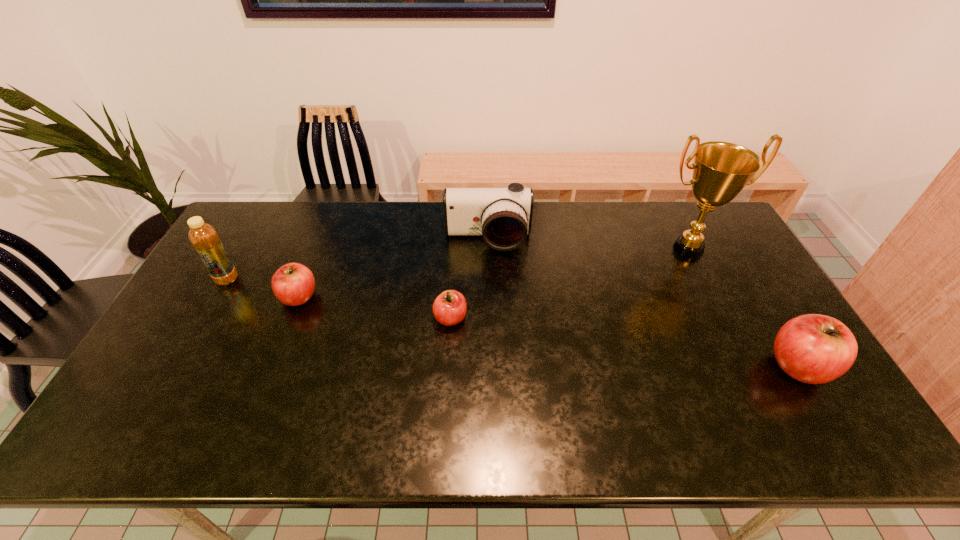
Please mark a free spot for a new apple to balance the arrangement. Please provide its 2D coordinates. Your answer should be formatted as a tuple, i.e. [(x, y)], where the tuple contains the x and y coordinates of a point satisfying the conditions above.

[(616, 341)]